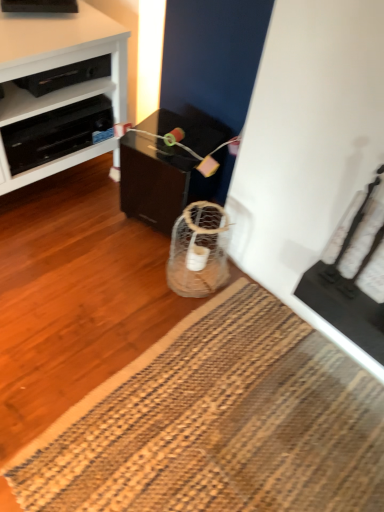
This screenshot has width=384, height=512. Describe the element at coordinates (47, 99) in the screenshot. I see `black plastic shelf at upper left` at that location.

What do you see at coordinates (218, 423) in the screenshot? I see `natural fiber mat at lower center` at bounding box center [218, 423].

Describe the element at coordinates (60, 59) in the screenshot. I see `white glossy cabinet at left` at that location.

Where is `black plastic drawer at upper left`? This screenshot has width=384, height=512. black plastic drawer at upper left is located at coordinates (55, 133).

The height and width of the screenshot is (512, 384). What do you see at coordinates (55, 133) in the screenshot?
I see `black plastic drawer at upper left` at bounding box center [55, 133].

Identify the location of black glossy table at center. (161, 180).

Find the location of `desk that appears in front of the black plastic drawer at upper left`. desk that appears in front of the black plastic drawer at upper left is located at coordinates (60, 59).

Consider the image. Does white glossy cabinet at left have a smaller size compared to black plastic drawer at upper left?

No, white glossy cabinet at left is not smaller than black plastic drawer at upper left.

Does white glossy cabinet at left turn towards black plastic drawer at upper left?

Yes, white glossy cabinet at left is facing black plastic drawer at upper left.

Is natural fiber mat at lower center located within white glossy cabinet at left?

No.

Measure the distance between white glossy cabinet at left and natural fiber mat at lower center.

A distance of 3.28 feet exists between white glossy cabinet at left and natural fiber mat at lower center.

Can you confirm if white glossy cabinet at left is shorter than natural fiber mat at lower center?

Incorrect, the height of white glossy cabinet at left does not fall short of that of natural fiber mat at lower center.

Where is `mat located on the right of white glossy cabinet at left`? The width and height of the screenshot is (384, 512). mat located on the right of white glossy cabinet at left is located at coordinates (218, 423).

Does black plastic drawer at upper left have a greater height compared to white glossy cabinet at left?

In fact, black plastic drawer at upper left may be shorter than white glossy cabinet at left.

Does black plastic drawer at upper left come behind white glossy cabinet at left?

Yes, the depth of black plastic drawer at upper left is greater than that of white glossy cabinet at left.

Which object is thinner, black plastic drawer at upper left or white glossy cabinet at left?

black plastic drawer at upper left.

I want to click on drawer behind the white glossy cabinet at left, so click(55, 133).

Does natural fiber mat at lower center come in front of white glossy cabinet at left?

Yes, the depth of natural fiber mat at lower center is less than that of white glossy cabinet at left.

Who is bigger, natural fiber mat at lower center or white glossy cabinet at left?

Bigger between the two is white glossy cabinet at left.

Which object is positioned more to the left, natural fiber mat at lower center or white glossy cabinet at left?

white glossy cabinet at left is more to the left.

From the image's perspective, is black plastic shelf at upper left above or below white glossy cabinet at left?

Based on their image positions, black plastic shelf at upper left is located above white glossy cabinet at left.

Is white glossy cabinet at left at the back of black plastic shelf at upper left?

Yes.

Between black plastic shelf at upper left and white glossy cabinet at left, which one appears on the left side from the viewer's perspective?

Positioned to the left is white glossy cabinet at left.

In terms of height, does black plastic shelf at upper left look taller or shorter compared to white glossy cabinet at left?

black plastic shelf at upper left is shorter than white glossy cabinet at left.

Consider the image. What's the angular difference between white glossy cabinet at left and black glossy table at center's facing directions?

70.8 degrees separate the facing orientations of white glossy cabinet at left and black glossy table at center.

Which of these two, white glossy cabinet at left or black glossy table at center, is bigger?

white glossy cabinet at left.

Based on the photo, are white glossy cabinet at left and black glossy table at center making contact?

white glossy cabinet at left and black glossy table at center are not in contact.

Considering the relative sizes of white glossy cabinet at left and black glossy table at center in the image provided, is white glossy cabinet at left taller than black glossy table at center?

Correct, white glossy cabinet at left is much taller as black glossy table at center.

Considering the positions of points (81, 156) and (45, 109), is point (81, 156) closer to camera compared to point (45, 109)?

No, it is behind (45, 109).

Can you confirm if white glossy cabinet at left is shorter than black plastic shelf at upper left?

In fact, white glossy cabinet at left may be taller than black plastic shelf at upper left.

Which object is positioned more to the right, white glossy cabinet at left or black plastic shelf at upper left?

Positioned to the right is black plastic shelf at upper left.

Measure the distance from white glossy cabinet at left to black plastic shelf at upper left.

They are 3.70 inches apart.

This screenshot has width=384, height=512. I want to click on drawer below the white glossy cabinet at left (from a real-world perspective), so click(55, 133).

Identify the location of mat on the right of white glossy cabinet at left. (218, 423).

When comparing their distances from black plastic drawer at upper left, does black plastic shelf at upper left or white glossy cabinet at left seem closer?

black plastic shelf at upper left lies closer to black plastic drawer at upper left than the other object.

Considering their positions, is black glossy table at center positioned further to black plastic shelf at upper left than black plastic drawer at upper left?

black glossy table at center is positioned further to the anchor black plastic shelf at upper left.

Based on their spatial positions, is black plastic shelf at upper left or black plastic drawer at upper left further from natural fiber mat at lower center?

Based on the image, black plastic shelf at upper left appears to be further to natural fiber mat at lower center.

From the image, which object appears to be farther from black plastic drawer at upper left, white glossy cabinet at left or natural fiber mat at lower center?

Based on the image, natural fiber mat at lower center appears to be further to black plastic drawer at upper left.

From the image, which object appears to be farther from natural fiber mat at lower center, black plastic drawer at upper left or white glossy cabinet at left?

Among the two, white glossy cabinet at left is located further to natural fiber mat at lower center.

In the scene shown: Estimate the real-world distances between objects in this image. Which object is further from natural fiber mat at lower center, black plastic drawer at upper left or black plastic shelf at upper left?

black plastic shelf at upper left lies further to natural fiber mat at lower center than the other object.

Based on their spatial positions, is natural fiber mat at lower center or black glossy table at center further from white glossy cabinet at left?

The object further to white glossy cabinet at left is natural fiber mat at lower center.

Considering their positions, is white glossy cabinet at left positioned closer to natural fiber mat at lower center than black plastic drawer at upper left?

Among the two, black plastic drawer at upper left is located nearer to natural fiber mat at lower center.

Find the location of a particular element. drawer between white glossy cabinet at left and natural fiber mat at lower center from top to bottom is located at coordinates (55, 133).

Image resolution: width=384 pixels, height=512 pixels. What are the coordinates of `table between black plastic shelf at upper left and natural fiber mat at lower center vertically` in the screenshot? It's located at (161, 180).

The width and height of the screenshot is (384, 512). In order to click on table between white glossy cabinet at left and natural fiber mat at lower center in the up-down direction in this screenshot , I will do `click(161, 180)`.

The width and height of the screenshot is (384, 512). Find the location of `shelf between white glossy cabinet at left and black glossy table at center from left to right`. shelf between white glossy cabinet at left and black glossy table at center from left to right is located at coordinates (47, 99).